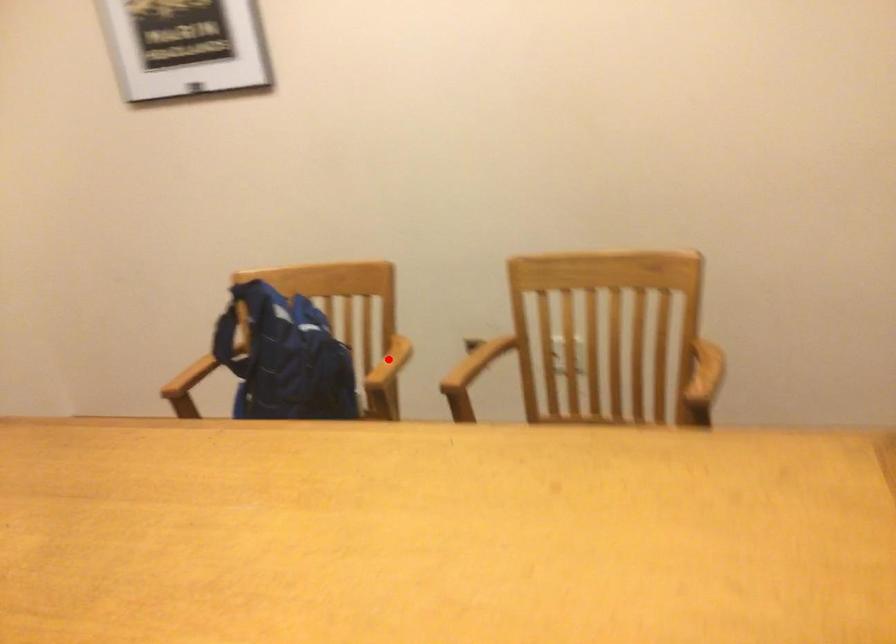
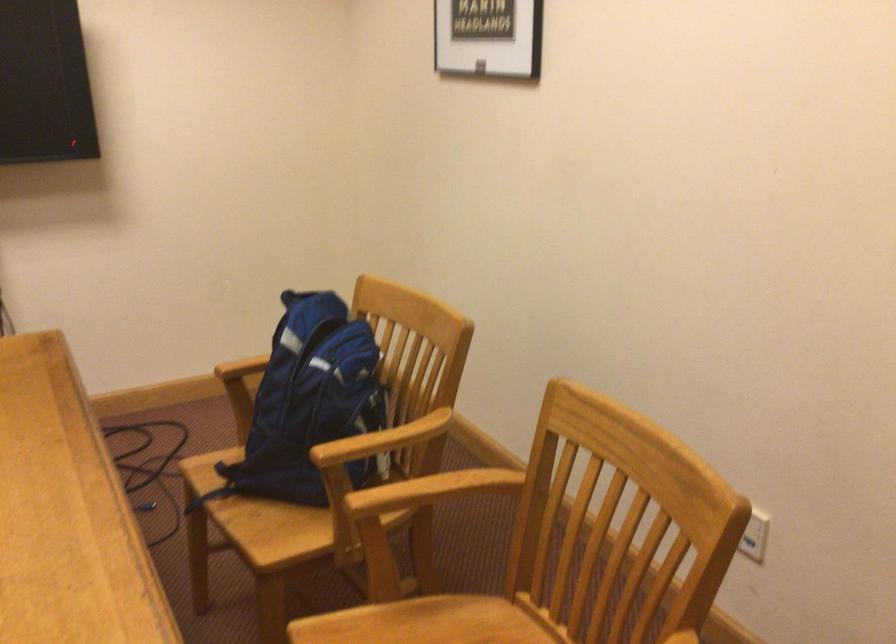
Question: I am providing you with two images of the same scene from different viewpoints. In image1, a red point is highlighted. Considering the same 3D point in image2, which of the following is correct?

Choices:
 (A) It is closer
 (B) It is farther

Answer: (A)